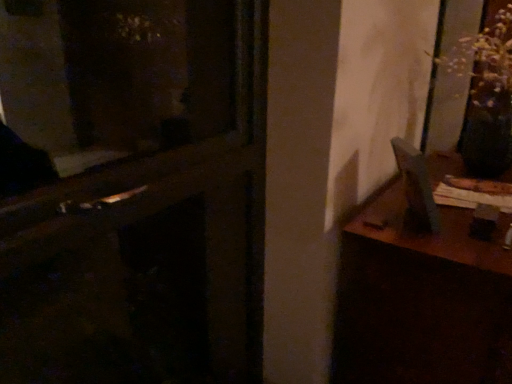
Question: Considering the relative sizes of wooden table at right and wooden door at center in the image provided, is wooden table at right taller than wooden door at center?

Choices:
 (A) yes
 (B) no

Answer: (B)

Question: Does wooden table at right turn towards wooden door at center?

Choices:
 (A) no
 (B) yes

Answer: (A)

Question: Can we say wooden table at right lies outside wooden door at center?

Choices:
 (A) no
 (B) yes

Answer: (B)

Question: Is wooden table at right smaller than wooden door at center?

Choices:
 (A) yes
 (B) no

Answer: (B)

Question: Is wooden table at right touching wooden door at center?

Choices:
 (A) no
 (B) yes

Answer: (A)

Question: From a real-world perspective, is wooden table at right on top of wooden door at center?

Choices:
 (A) no
 (B) yes

Answer: (A)

Question: Is wooden door at center thinner than wooden table at right?

Choices:
 (A) no
 (B) yes

Answer: (B)

Question: From a real-world perspective, is wooden door at center on top of wooden table at right?

Choices:
 (A) yes
 (B) no

Answer: (A)

Question: Considering the relative sizes of wooden door at center and wooden table at right in the image provided, is wooden door at center taller than wooden table at right?

Choices:
 (A) no
 (B) yes

Answer: (B)

Question: Can you confirm if wooden door at center is positioned to the left of wooden table at right?

Choices:
 (A) yes
 (B) no

Answer: (A)

Question: Can you confirm if wooden door at center is bigger than wooden table at right?

Choices:
 (A) no
 (B) yes

Answer: (A)

Question: Are wooden door at center and wooden table at right located far from each other?

Choices:
 (A) yes
 (B) no

Answer: (A)

Question: Is wooden table at right to the left or to the right of wooden door at center in the image?

Choices:
 (A) left
 (B) right

Answer: (B)